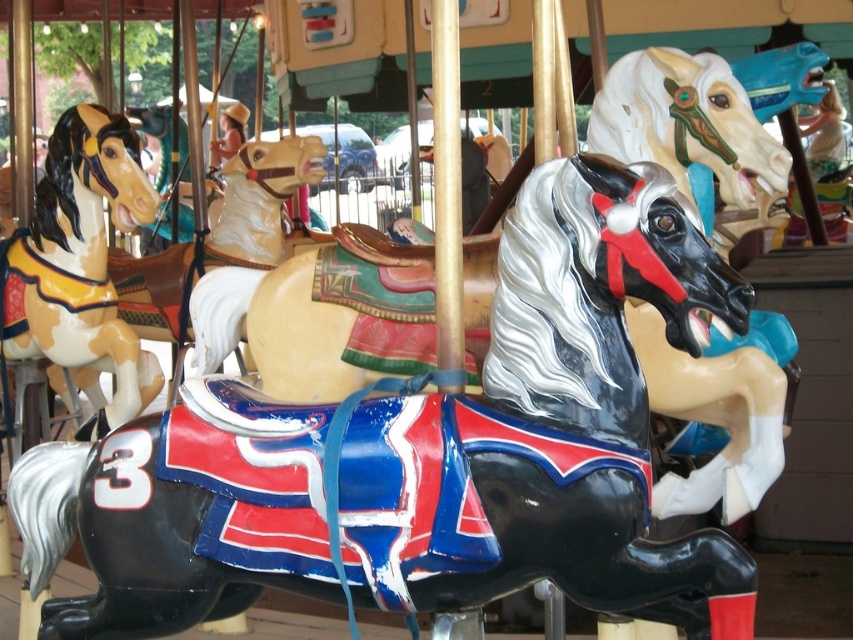
You are a photographer standing in front of the carousel. You want to take a clear photo of both the shiny black horse at center and the matte brown horse at left. Which horse should you focus on first to ensure both are in focus?

You should focus on the shiny black horse at center first because it is closer to the viewer than the matte brown horse at left. By focusing on the closer horse, the background horse will also be in focus due to the depth of field.

You are a child trying to spot the shiny black horse at center and the matte brown horse at left on the carousel. Based on their positions, which horse is closer to the ground?

The shiny black horse at center is closer to the ground because it is positioned below the matte brown horse at left.